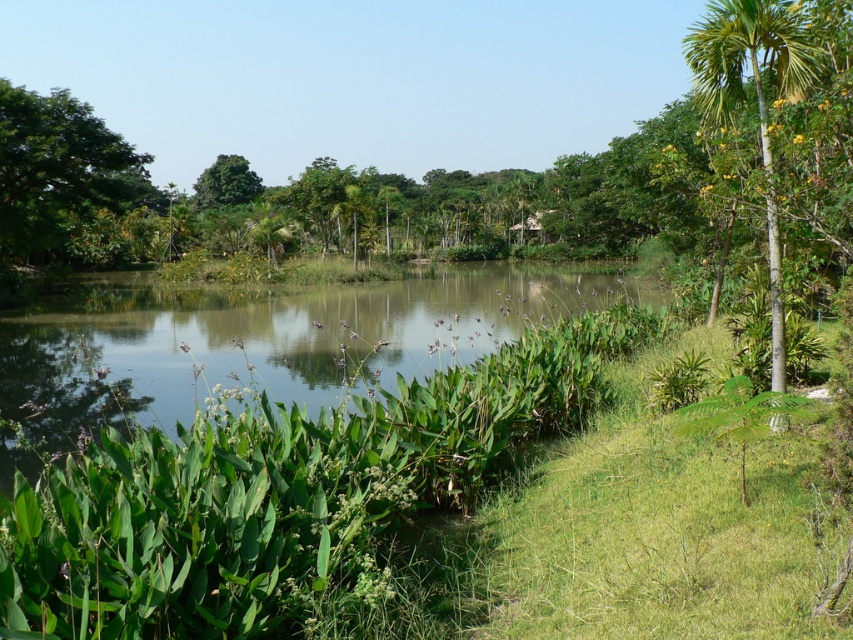
Question: Which is farther from the green leafy tree at upper center?

Choices:
 (A) green leafy tree at upper left
 (B) green leafy palm tree at right
 (C) green leafy river at center

Answer: (B)

Question: Among these objects, which one is farthest from the camera?

Choices:
 (A) green leafy tree at upper center
 (B) green leafy river at center
 (C) green leafy palm tree at right
 (D) green leafy tree at upper left

Answer: (A)

Question: Can you confirm if green leafy river at center is positioned to the left of green leafy tree at upper center?

Choices:
 (A) yes
 (B) no

Answer: (B)

Question: Can you confirm if green leafy palm tree at right is bigger than green leafy tree at upper center?

Choices:
 (A) no
 (B) yes

Answer: (A)

Question: Estimate the real-world distances between objects in this image. Which object is closer to the green leafy tree at upper left?

Choices:
 (A) green leafy palm tree at right
 (B) green leafy river at center

Answer: (B)

Question: Can you confirm if green leafy river at center is positioned to the right of green leafy tree at upper left?

Choices:
 (A) no
 (B) yes

Answer: (B)